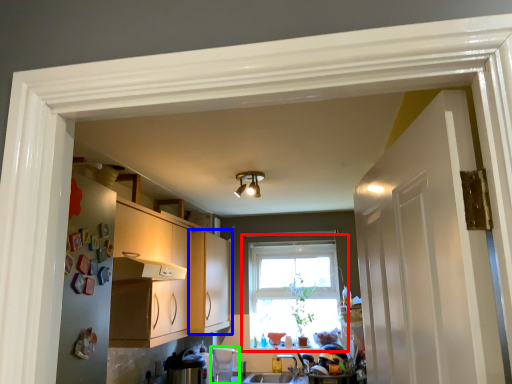
Question: Considering the real-world distances, which object is farthest from window (highlighted by a red box)? cabinetry (highlighted by a blue box) or appliance (highlighted by a green box)?

Choices:
 (A) cabinetry
 (B) appliance

Answer: (B)